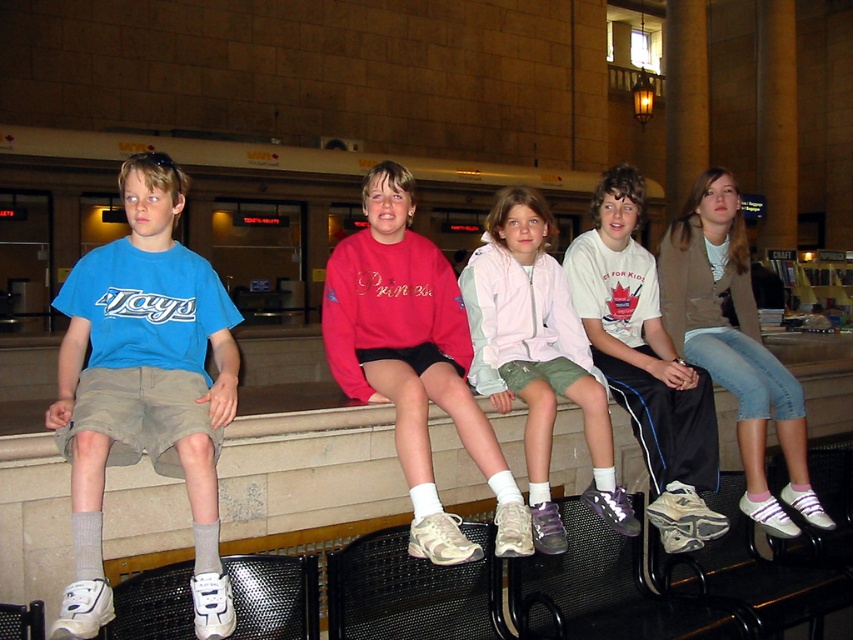
Does matte pink sweatshirt at center come behind white athletic shoe at center?

No, matte pink sweatshirt at center is in front of white athletic shoe at center.

At what (x,y) coordinates should I click in order to perform the action: click on matte pink sweatshirt at center. Please return your answer as a coordinate pair (x, y). Looking at the image, I should click on (x=413, y=362).

In order to click on matte pink sweatshirt at center in this screenshot , I will do 413,362.

Can you confirm if matte pink sweatshirt at center is thinner than light pink fabric jacket at center?

Incorrect, matte pink sweatshirt at center's width is not less than light pink fabric jacket at center's.

Between point (329, 312) and point (526, 259), which one is positioned behind?

The point (526, 259) is more distant.

This screenshot has height=640, width=853. I want to click on matte pink sweatshirt at center, so click(413, 362).

Does matte blue t-shirt at left have a lesser width compared to light pink fabric jacket at center?

In fact, matte blue t-shirt at left might be wider than light pink fabric jacket at center.

Which is in front, point (206, 442) or point (572, 397)?

Point (206, 442) is in front.

You are a GUI agent. You are given a task and a screenshot of the screen. Output one action in this format:
    pyautogui.click(x=<x>, y=<y>)
    Task: Click on the matte blue t-shirt at left
    Image resolution: width=853 pixels, height=640 pixels.
    Given the screenshot: What is the action you would take?
    pyautogui.click(x=144, y=388)